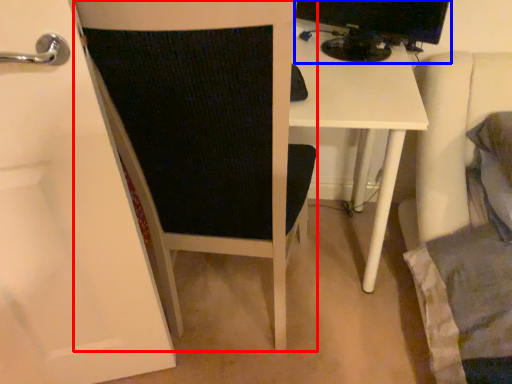
Question: Which object appears closest to the camera in this image, furniture (highlighted by a red box) or desktop computer (highlighted by a blue box)?

Choices:
 (A) furniture
 (B) desktop computer

Answer: (A)